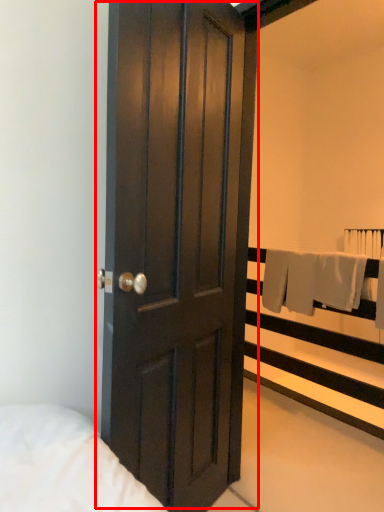
Question: In this image, where is door (annotated by the red box) located relative to balustrade?

Choices:
 (A) left
 (B) right

Answer: (A)